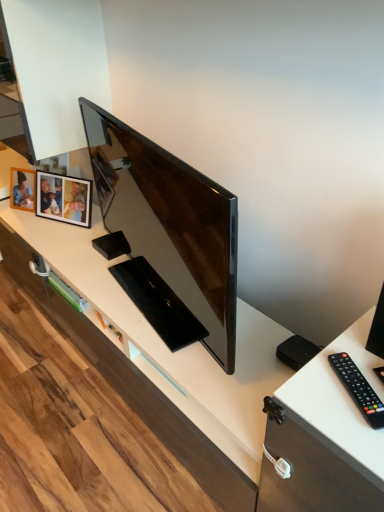
In order to face matte black tv at center, should I rotate leftwards or rightwards?

You should rotate left by 5.552 degrees.

Where is `wooden photo frame at upper left`? wooden photo frame at upper left is located at coordinates (64, 198).

Find the location of `matte black tv at center`. matte black tv at center is located at coordinates (170, 222).

You are a GUI agent. You are given a task and a screenshot of the screen. Output one action in this format:
    pyautogui.click(x=<x>, y=<y>)
    Task: Click on the television above the black plastic remote at right (from a real-world perspective)
    
    Given the screenshot: What is the action you would take?
    pyautogui.click(x=170, y=222)

Choose the correct answer: Is black plastic remote at right inside matte black tv at center or outside it?

black plastic remote at right is not enclosed by matte black tv at center.

Is black plastic remote at right in front of matte black tv at center?

Yes, it is in front of matte black tv at center.

Does matte black tv at center have a smaller size compared to wooden photo frame at upper left?

No.

In the scene shown: From a real-world perspective, is matte black tv at center beneath wooden photo frame at upper left?

No, from a real-world perspective, matte black tv at center is not under wooden photo frame at upper left.

Is point (112, 211) less distant than point (53, 175)?

Yes, point (112, 211) is closer to viewer.

Is matte black tv at center turned away from wooden photo frame at upper left?

No.

Is black plastic remote at right oriented towards wooden photo frame at upper left?

No, black plastic remote at right is not aimed at wooden photo frame at upper left.

You are a GUI agent. You are given a task and a screenshot of the screen. Output one action in this format:
    pyautogui.click(x=<x>, y=<y>)
    Task: Click on the remote control above the wooden photo frame at upper left (from a real-world perspective)
    
    Given the screenshot: What is the action you would take?
    pyautogui.click(x=358, y=389)

In the image, is black plastic remote at right on the left side or the right side of wooden photo frame at upper left?

Based on their positions, black plastic remote at right is located to the right of wooden photo frame at upper left.

From a real-world perspective, which is physically above, black plastic remote at right or wooden photo frame at upper left?

black plastic remote at right.

Which object is positioned more to the right, wooden photo frame at upper left or matte black tv at center?

matte black tv at center.

Who is taller, wooden photo frame at upper left or matte black tv at center?

Standing taller between the two is matte black tv at center.

Is wooden photo frame at upper left outside of matte black tv at center?

Indeed, wooden photo frame at upper left is completely outside matte black tv at center.

From the image's perspective, is wooden photo frame at upper left beneath matte black tv at center?

Incorrect, from the image's perspective, wooden photo frame at upper left is higher than matte black tv at center.

Considering the sizes of objects wooden photo frame at upper left and black plastic remote at right in the image provided, who is thinner, wooden photo frame at upper left or black plastic remote at right?

Thinner between the two is black plastic remote at right.

From a real-world perspective, is wooden photo frame at upper left positioned above or below black plastic remote at right?

wooden photo frame at upper left is below black plastic remote at right.

Does wooden photo frame at upper left have a lesser height compared to black plastic remote at right?

Incorrect, the height of wooden photo frame at upper left does not fall short of that of black plastic remote at right.

Can you tell me how much wooden photo frame at upper left and black plastic remote at right differ in facing direction?

55.6 degrees.

Between matte black tv at center and black plastic remote at right, which one appears on the left side from the viewer's perspective?

matte black tv at center.

Measure the distance between matte black tv at center and black plastic remote at right.

matte black tv at center is 26.10 inches away from black plastic remote at right.

Which is behind, matte black tv at center or black plastic remote at right?

matte black tv at center is more distant.

Is matte black tv at center not near black plastic remote at right?

No, matte black tv at center is in close proximity to black plastic remote at right.

Where is `television on the left side of black plastic remote at right`? television on the left side of black plastic remote at right is located at coordinates (170, 222).

This screenshot has height=512, width=384. I want to click on television on the right of wooden photo frame at upper left, so 170,222.

Based on their spatial positions, is black plastic remote at right or wooden photo frame at upper left further from matte black tv at center?

black plastic remote at right is further to matte black tv at center.

Estimate the real-world distances between objects in this image. Which object is further from black plastic remote at right, wooden photo frame at upper left or matte black tv at center?

Based on the image, wooden photo frame at upper left appears to be further to black plastic remote at right.

Which object lies further to the anchor point black plastic remote at right, matte black tv at center or wooden photo frame at upper left?

Based on the image, wooden photo frame at upper left appears to be further to black plastic remote at right.

When comparing their distances from wooden photo frame at upper left, does black plastic remote at right or matte black tv at center seem closer?

matte black tv at center.

Looking at the image, which one is located further to wooden photo frame at upper left, matte black tv at center or black plastic remote at right?

black plastic remote at right is positioned further to the anchor wooden photo frame at upper left.

Considering their positions, is wooden photo frame at upper left positioned closer to matte black tv at center than black plastic remote at right?

wooden photo frame at upper left is positioned closer to the anchor matte black tv at center.

At what (x,y) coordinates should I click in order to perform the action: click on television positioned between black plastic remote at right and wooden photo frame at upper left from near to far. Please return your answer as a coordinate pair (x, y). Looking at the image, I should click on (170, 222).